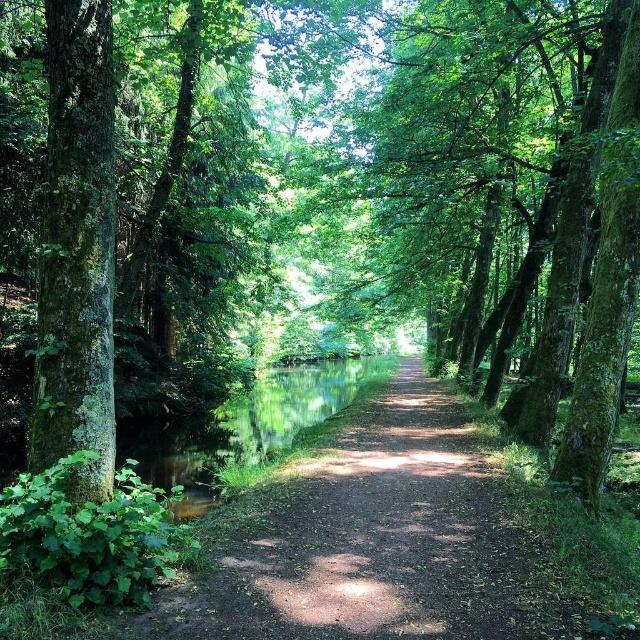
Looking at this image, you are a hiker carrying a 2.5 meter long wooden beam. You need to transport it along the dirt path at center while avoiding the green mossy tree at left. Is the path wide enough to accommodate the beam without touching the tree?

The dirt path at center might be wider than green mossy tree at left, so there is a possibility that the path is wide enough to accommodate the 2.5 meter long wooden beam without touching the tree. However, since the exact width isn not provided, it is recommended to proceed with caution.

You are a hiker with a 4.5 feet wide backpack. You are standing on the dirt path at center and want to move towards the green mossy tree at left. Can you pass through the space between them without moving the tree?

The dirt path at center and green mossy tree at left are 5.00 feet apart, so yes, the hiker can pass through the space between them since the distance is greater than the backpack width of 4.5 feet.